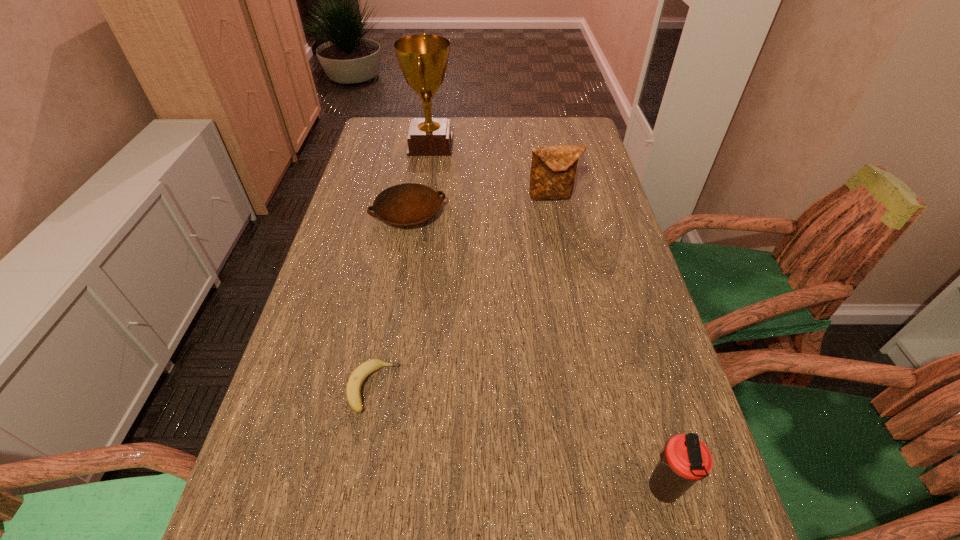
Locate an element on the screen. Image resolution: width=960 pixels, height=540 pixels. vacant space at the left edge of the desktop is located at coordinates (373, 174).

In the image, there is a desktop. Where is `vacant space at the right edge`? The height and width of the screenshot is (540, 960). vacant space at the right edge is located at coordinates (596, 155).

At what (x,y) coordinates should I click in order to perform the action: click on vacant space at the far right corner of the desktop. Please return your answer as a coordinate pair (x, y). This screenshot has height=540, width=960. Looking at the image, I should click on (587, 124).

Where is `free area in between the award and the clutch bag`? This screenshot has width=960, height=540. free area in between the award and the clutch bag is located at coordinates (492, 171).

I want to click on unoccupied area between the fourth farthest object and the tallest object, so click(x=402, y=266).

This screenshot has height=540, width=960. I want to click on free space between the fourth tallest object and the second nearest object, so click(x=391, y=301).

Locate an element on the screen. The height and width of the screenshot is (540, 960). unoccupied position between the banana and the plate is located at coordinates (391, 301).

What are the coordinates of `blank region between the plate and the clutch bag` in the screenshot? It's located at (480, 206).

In order to click on empty location between the thermos bottle and the farthest object in this screenshot , I will do `click(546, 317)`.

The width and height of the screenshot is (960, 540). I want to click on free space between the tallest object and the clutch bag, so tap(492, 171).